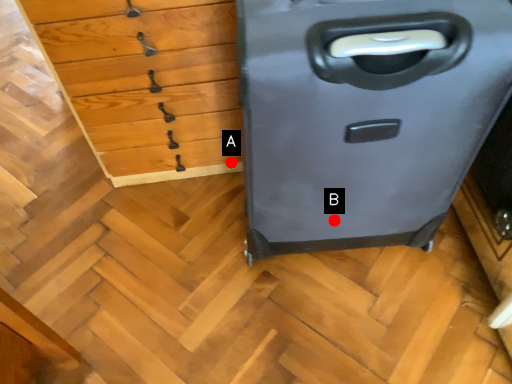
Question: Two points are circled on the image, labeled by A and B beside each circle. Which point is closer to the camera?

Choices:
 (A) A is closer
 (B) B is closer

Answer: (B)